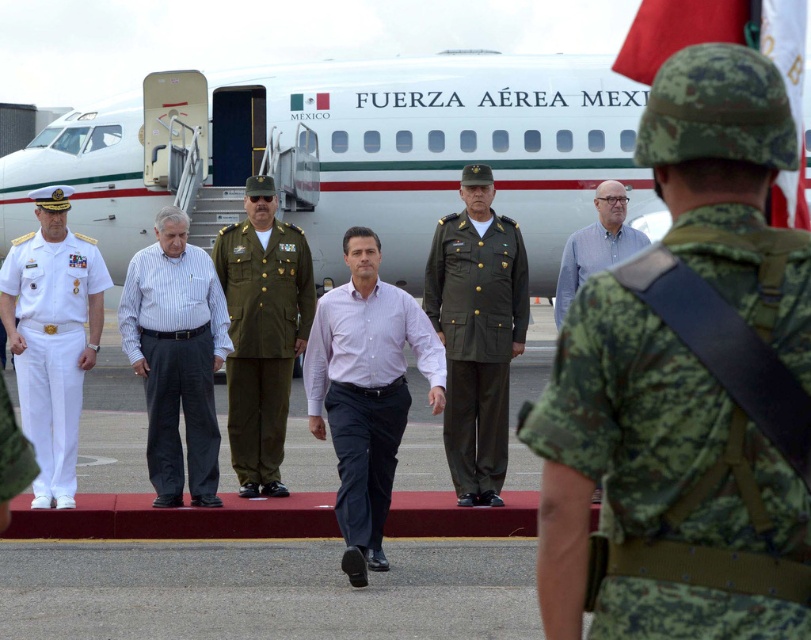
You are standing at the airport tarmac and see two points marked in the scene. The first point is at coordinate point (503,284) and the second is at point (16,244). Which point is closer to you?

Point (503,284) is further to the camera than point (16,244), so the second point is closer to you.

You are attending the event and notice two people in the front row wearing shirts of different colors. The purple cotton shirt at center and the light blue shirt at center. Which shirt is positioned more to the left?

The purple cotton shirt at center is positioned more to the left than the light blue shirt at center.